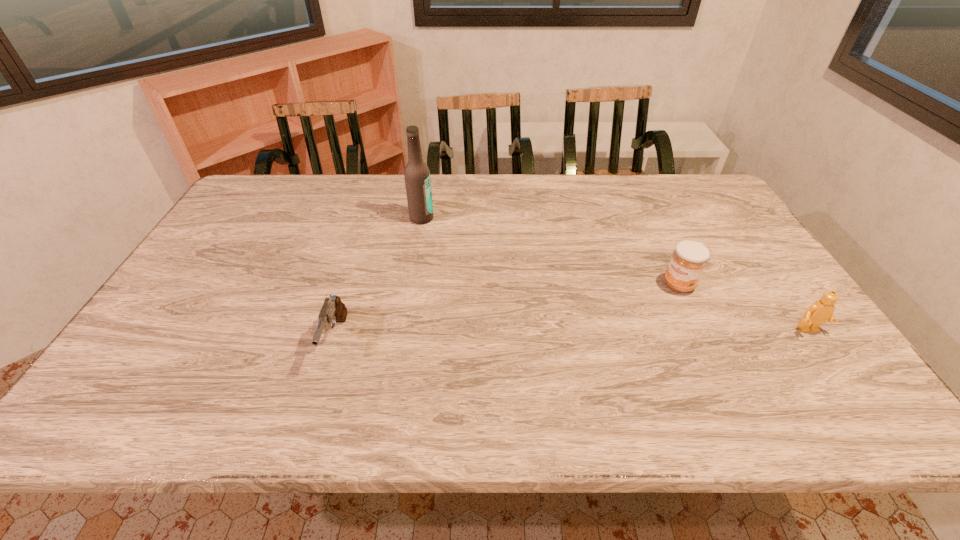
Find the location of a particular element. free space between the rightmost object and the leftmost object is located at coordinates (572, 335).

The image size is (960, 540). What are the coordinates of `vacant space that's between the jam and the third object from right to left` in the screenshot? It's located at (550, 252).

Choose which object is the second nearest neighbor to the pistol. Please provide its 2D coordinates. Your answer should be formatted as a tuple, i.e. [(x, y)], where the tuple contains the x and y coordinates of a point satisfying the conditions above.

[(688, 261)]

Identify which object is the second nearest to the beer bottle. Please provide its 2D coordinates. Your answer should be formatted as a tuple, i.e. [(x, y)], where the tuple contains the x and y coordinates of a point satisfying the conditions above.

[(688, 261)]

This screenshot has height=540, width=960. In order to click on free space that satisfies the following two spatial constraints: 1. on the front side of the third object from right to left; 2. on the left side of the second farthest object in this screenshot , I will do `click(411, 285)`.